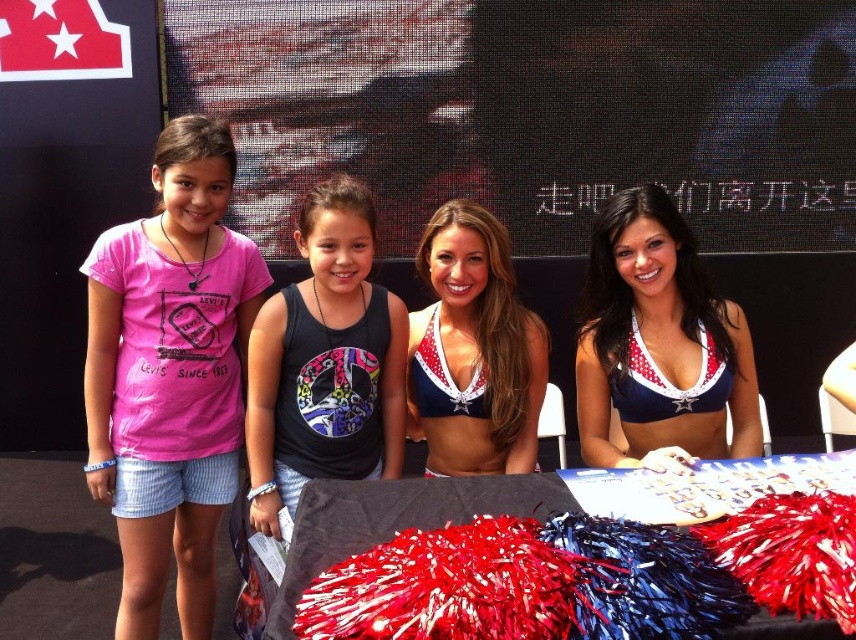
Consider the image. Is red and white bikini top at center above black matte tank top at center?

Correct, red and white bikini top at center is located above black matte tank top at center.

Identify the location of red and white bikini top at center. (658, 344).

Locate an element on the screen. red and white bikini top at center is located at coordinates (658, 344).

Does pink cotton t-shirt at left have a greater height compared to red fabric pom-poms at center?

Yes.

Does point (163, 356) come closer to viewer compared to point (486, 483)?

No, (163, 356) is further to viewer.

Locate an element on the screen. This screenshot has width=856, height=640. pink cotton t-shirt at left is located at coordinates (170, 376).

Does pink cotton t-shirt at left have a greater height compared to black matte tank top at center?

Yes, pink cotton t-shirt at left is taller than black matte tank top at center.

In the scene shown: Who is higher up, pink cotton t-shirt at left or black matte tank top at center?

black matte tank top at center is higher up.

Who is more forward, (153, 300) or (379, 461)?

Point (153, 300)

Locate an element on the screen. This screenshot has height=640, width=856. pink cotton t-shirt at left is located at coordinates (170, 376).